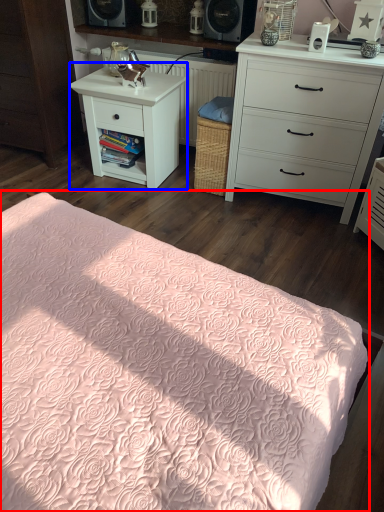
Question: Which object is further to the camera taking this photo, bed (highlighted by a red box) or nightstand (highlighted by a blue box)?

Choices:
 (A) bed
 (B) nightstand

Answer: (B)